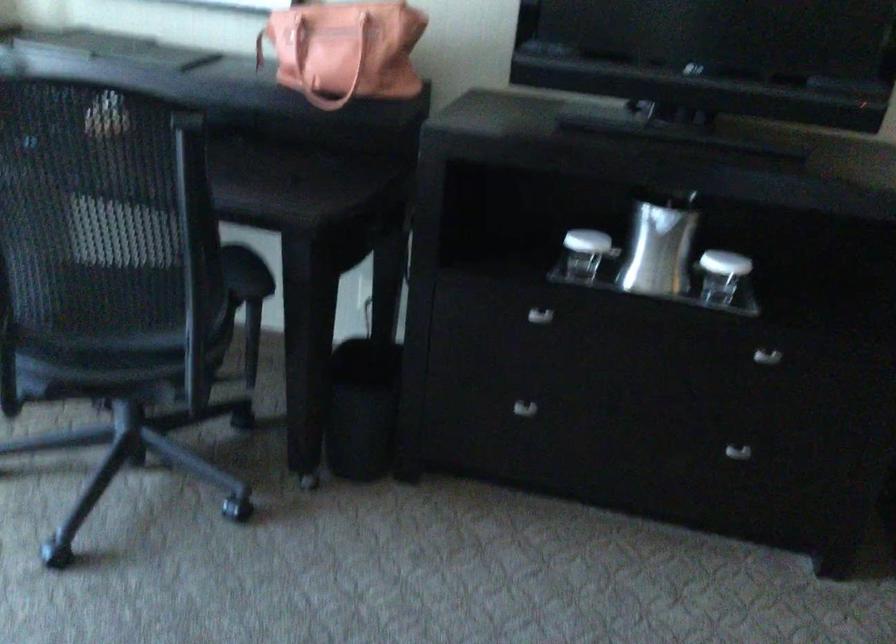
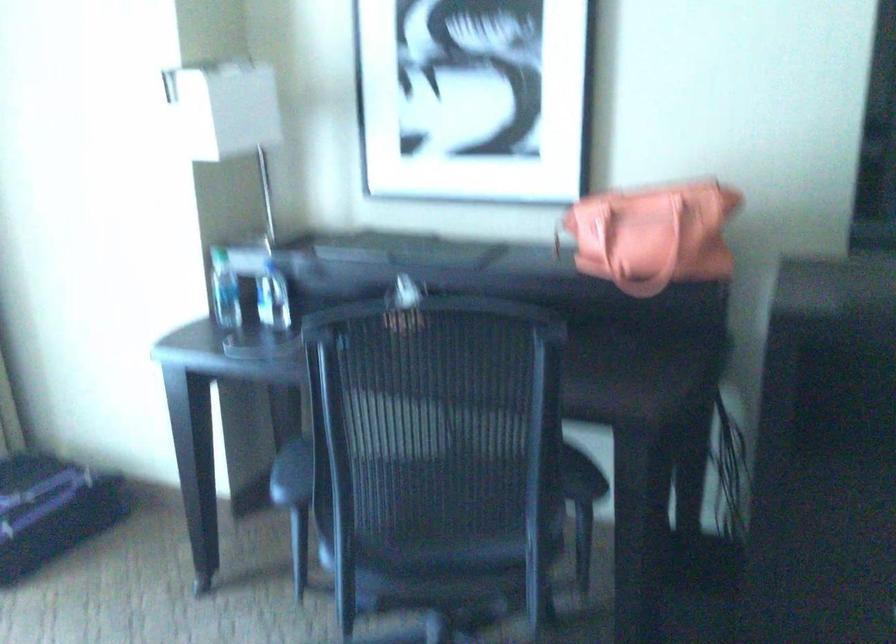
Locate, in the second image, the point that corresponds to the point at 125,332 in the first image.

(458, 544)